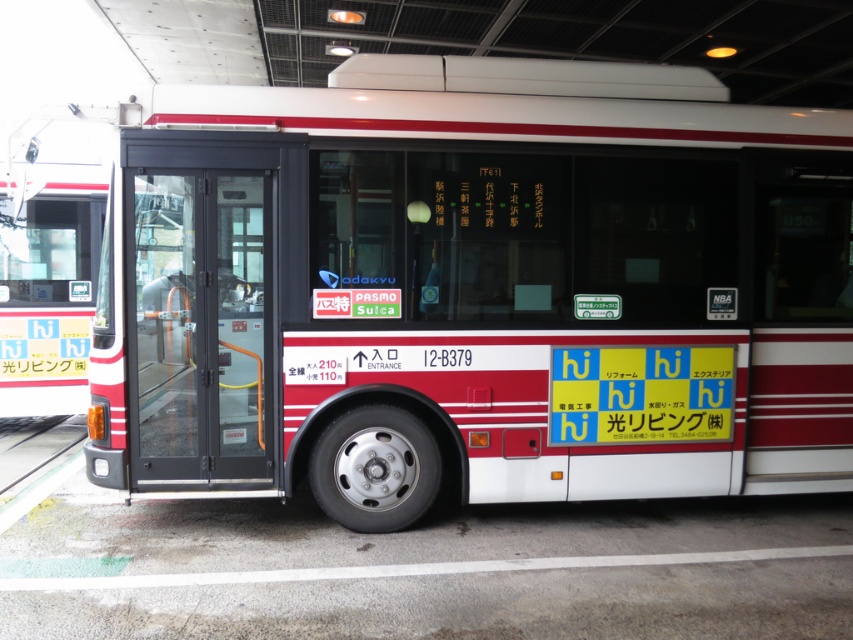
Is black glass door at center thinner than white plastic license plate at center?

Correct, black glass door at center's width is less than white plastic license plate at center's.

Is black glass door at center above white plastic license plate at center?

Correct, black glass door at center is located above white plastic license plate at center.

Describe the element at coordinates (199, 328) in the screenshot. The image size is (853, 640). I see `black glass door at center` at that location.

This screenshot has height=640, width=853. What are the coordinates of `black glass door at center` in the screenshot? It's located at (199, 328).